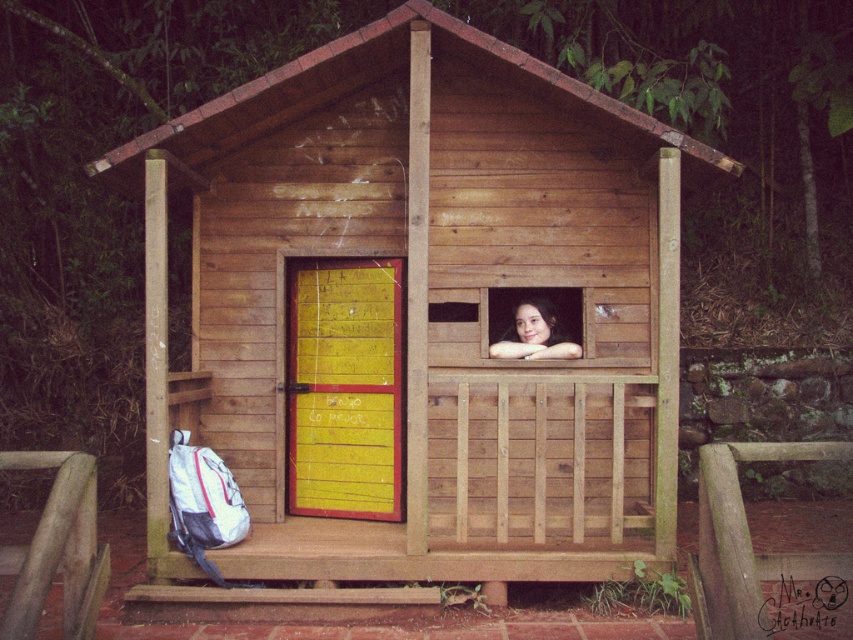
Question: Does wooden cabin at center have a smaller size compared to wooden bench at lower center?

Choices:
 (A) no
 (B) yes

Answer: (A)

Question: Considering the real-world distances, which object is farthest from the wooden bench at lower center?

Choices:
 (A) smooth skin at window center
 (B) wooden cabin at center

Answer: (A)

Question: Is wooden cabin at center to the left of smooth skin at window center from the viewer's perspective?

Choices:
 (A) no
 (B) yes

Answer: (B)

Question: Which point is closer to the camera?

Choices:
 (A) wooden cabin at center
 (B) smooth skin at window center
 (C) wooden bench at lower center

Answer: (C)

Question: Which point is farther to the camera?

Choices:
 (A) wooden bench at lower center
 (B) wooden cabin at center

Answer: (B)

Question: Can you confirm if wooden cabin at center is bigger than smooth skin at window center?

Choices:
 (A) no
 (B) yes

Answer: (B)